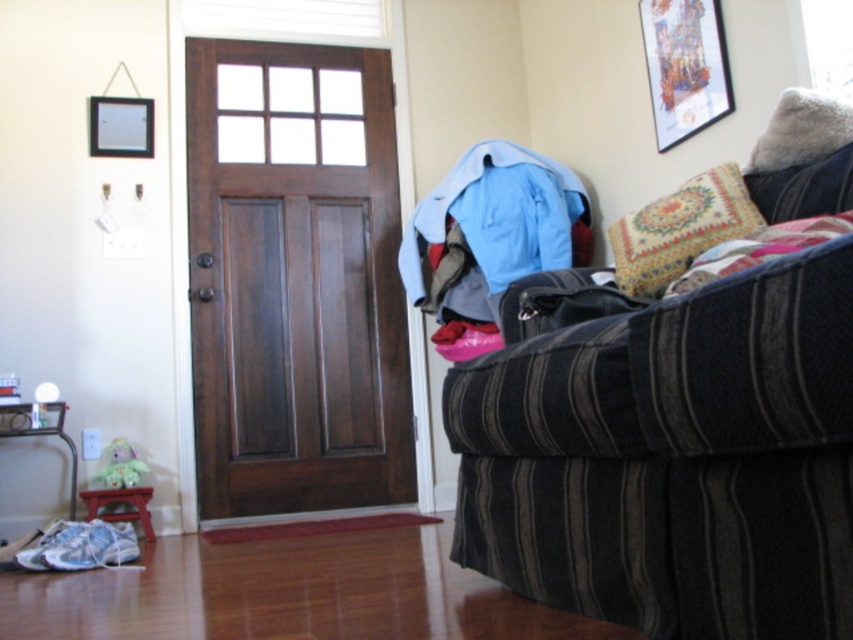
You are a delivery person who just arrived at this house. You need to place a large package on the floor near the striped fabric couch at right and the wooden picture frame at upper right. Since the package is heavy, you want to put it on the surface that can support its weight. Which object should you choose?

The striped fabric couch at right is much taller than the wooden picture frame at upper right, so the couch is more likely to be sturdy enough to support the heavy package. Place the package near the striped fabric couch at right.

You are an interior designer assessing the living room layout. You need to place a new rectangular side table between the patterned fabric pillow at right and the brushed metal hardwood at lower left. Based on their heights, will the table be stable?

The patterned fabric pillow at right is shorter than the brushed metal hardwood at lower left, so the table might wobble if placed directly between them due to the uneven heights. Consider placing it closer to the taller brushed metal hardwood at lower left for stability.

You are a delivery person trying to place a package on the floor in this living room. The package is 1 meter long. Can you place it horizontally between the patterned fabric pillow at right and the brushed metal hardwood at lower left without overlapping any objects?

The patterned fabric pillow at right is in front of the brushed metal hardwood at lower left, meaning there is space between them. Since the package is 1 meter long and the distance between the two objects isn